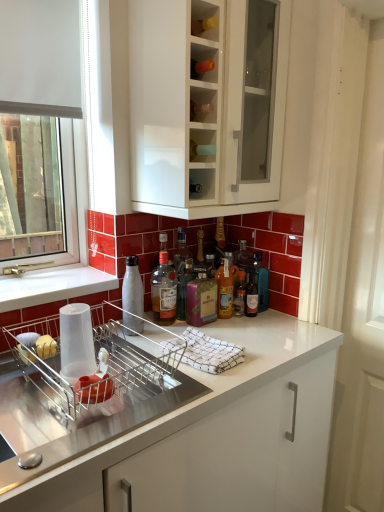
Question: Which is correct: purple glass bottle at center, placed as the 4th bottle when sorted from right to left, is inside translucent glass bottle at center, marked as the 6th bottle in a left-to-right arrangement, or outside of it?

Choices:
 (A) inside
 (B) outside

Answer: (B)

Question: From a real-world perspective, is purple glass bottle at center, placed as the 4th bottle when sorted from right to left, positioned above or below translucent glass bottle at center, marked as the 6th bottle in a left-to-right arrangement?

Choices:
 (A) above
 (B) below

Answer: (B)

Question: Which object is the farthest from the translucent glass bottle at center, placed as the first bottle when sorted from right to left?

Choices:
 (A) translucent glass bottle at center, arranged as the second bottle when viewed from the right
 (B) white textured screen door at right
 (C) transparent plastic cup at sink
 (D) white matte bottle at sink, placed as the 1th bottle when sorted from left to right
 (E) translucent glass bottle at center, the third bottle in the right-to-left sequence

Answer: (C)

Question: Estimate the real-world distances between objects in this image. Which object is closer to the transparent plastic cup at sink?

Choices:
 (A) translucent glass bottle at center, the fourth bottle in the left-to-right sequence
 (B) translucent glass bottle at center, acting as the 5th bottle starting from the right
 (C) white glossy cabinet at upper center
 (D) translucent glass bottle at center, marked as the fifth bottle in a left-to-right arrangement
 (E) translucent glass bottle at center, marked as the 6th bottle in a left-to-right arrangement

Answer: (B)